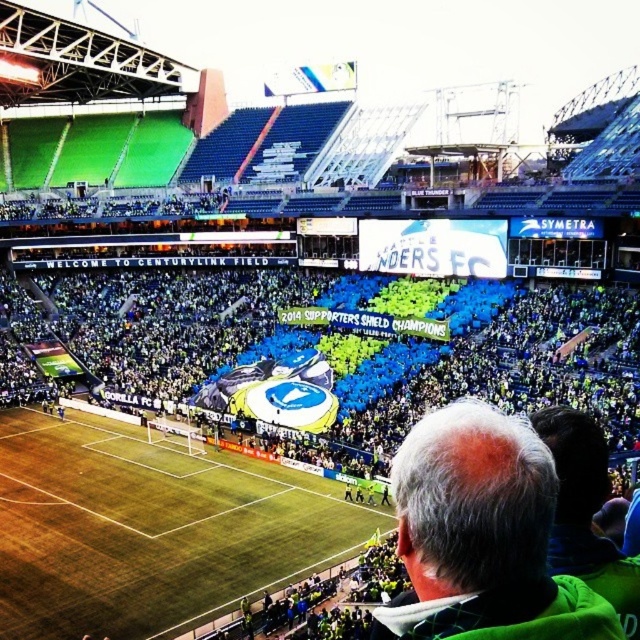
Between green grass football field at center and gray hair at upper center, which one appears on the left side from the viewer's perspective?

From the viewer's perspective, green grass football field at center appears more on the left side.

Does point (81, 611) lie behind point (634, 582)?

Yes, it is behind point (634, 582).

Locate an element on the screen. The width and height of the screenshot is (640, 640). green grass football field at center is located at coordinates (150, 529).

Image resolution: width=640 pixels, height=640 pixels. What do you see at coordinates (150, 529) in the screenshot? I see `green grass football field at center` at bounding box center [150, 529].

Is point (145, 580) positioned behind point (634, 609)?

That is True.

The height and width of the screenshot is (640, 640). I want to click on green grass football field at center, so click(x=150, y=529).

Is green fabric at lower right to the right of gray hair at upper center from the viewer's perspective?

Correct, you'll find green fabric at lower right to the right of gray hair at upper center.

Can you confirm if green fabric at lower right is positioned above gray hair at upper center?

Yes.

Between point (627, 598) and point (573, 561), which one is positioned in front?

Point (627, 598) is in front.

The image size is (640, 640). In order to click on green fabric at lower right in this screenshot , I will do `click(586, 513)`.